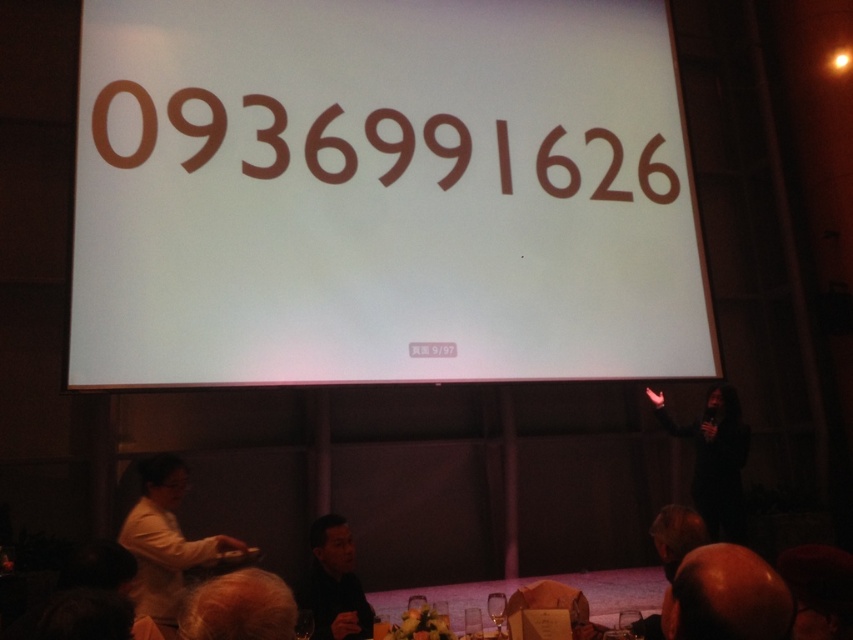
Question: Can you confirm if light brown hair at lower left is positioned to the left of dark gray shirt at lower center?

Choices:
 (A) yes
 (B) no

Answer: (A)

Question: Does smooth brown head at lower right have a lesser width compared to dark gray shirt at lower center?

Choices:
 (A) yes
 (B) no

Answer: (A)

Question: Which point is farther to the camera?

Choices:
 (A) (338, 586)
 (B) (753, 596)
 (C) (639, 586)
 (D) (167, 554)

Answer: (C)

Question: Which object is closer to the camera taking this photo?

Choices:
 (A) dark gray shirt at lower center
 (B) wooden table at lower center
 (C) smooth brown head at lower right
 (D) brown matte text at center

Answer: (C)

Question: Can you confirm if wooden table at lower center is wider than dark gray shirt at lower center?

Choices:
 (A) no
 (B) yes

Answer: (B)

Question: Estimate the real-world distances between objects in this image. Which object is farther from the brown matte text at center?

Choices:
 (A) light brown hair at lower left
 (B) dark gray shirt at lower center
 (C) wooden table at lower center

Answer: (A)